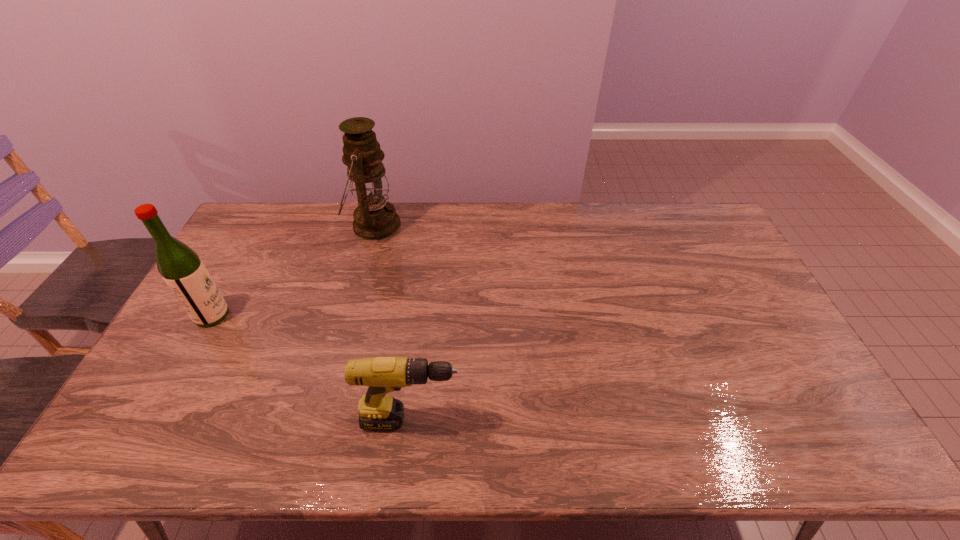
Find the location of a particular element. This screenshot has height=540, width=960. the second object from left to right is located at coordinates (375, 218).

Identify the location of the farthest object. (375, 218).

You are a GUI agent. You are given a task and a screenshot of the screen. Output one action in this format:
    pyautogui.click(x=<x>, y=<y>)
    Task: Click on the second nearest object
    The width and height of the screenshot is (960, 540).
    Given the screenshot: What is the action you would take?
    pyautogui.click(x=183, y=271)

You are a GUI agent. You are given a task and a screenshot of the screen. Output one action in this format:
    pyautogui.click(x=<x>, y=<y>)
    Task: Click on the leftmost object
    
    Given the screenshot: What is the action you would take?
    pyautogui.click(x=183, y=271)

Locate an element on the screen. The image size is (960, 540). the nearest object is located at coordinates (378, 411).

Where is `drill`? This screenshot has height=540, width=960. drill is located at coordinates (378, 411).

Identify the location of free space located 0.050m on the left of the second object from right to left. The image size is (960, 540). (334, 225).

Identify the location of vacant space located on the label of the leftmost object. The width and height of the screenshot is (960, 540). 278,315.

Where is `free space located on the handle side of the rightmost object`? free space located on the handle side of the rightmost object is located at coordinates (602, 420).

I want to click on object at the far edge, so click(x=375, y=218).